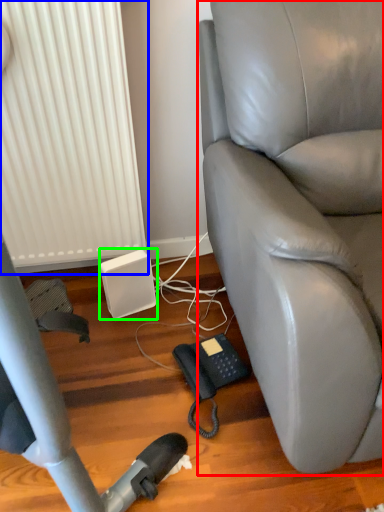
Question: Which object is the farthest from chair (highlighted by a red box)? Choose among these: radiator (highlighted by a blue box) or speaker (highlighted by a green box).

Choices:
 (A) radiator
 (B) speaker

Answer: (B)